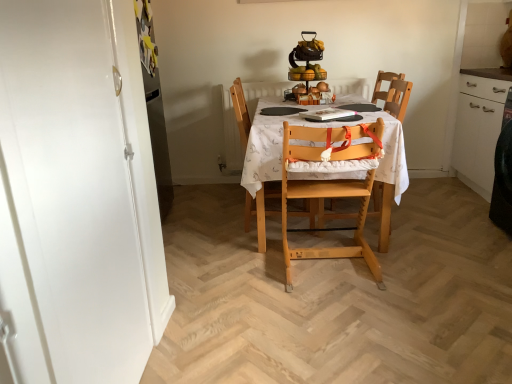
This screenshot has width=512, height=384. In order to click on vacant space positioned to the left of light wood highchair at center, acting as the 2th chair starting from the right in this screenshot , I will do `click(246, 266)`.